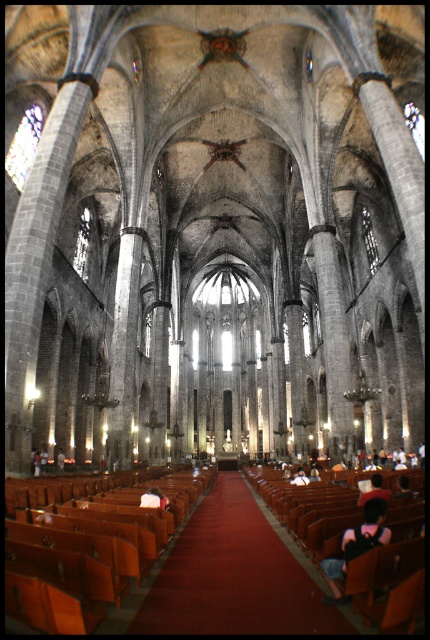
Based on the photo, you are standing at the entrance of the cathedral and want to sit down. The wooden polished chair at center is the only seating available. Based on its position, can you estimate how far it is from the entrance?

The wooden polished chair at center is located at point 0.900 on the x axis and 0.891 on the y axis, which means it is positioned near the back of the cathedral, close to the altar. Therefore, it is approximately 90 meters away from the entrance.

You are standing at the entrance of the cathedral and want to sit down. You see the wooden polished bench at center and the transparent glass window at upper center. Which object is closer to you?

The wooden polished bench at center is closer to you because it is in front of the transparent glass window at upper center, which is further away.

You are an architect visiting the cathedral and want to ensure that the wooden polished bench at center is protected from direct sunlight. Since the transparent glass window at upper right is the only window above it, can you confirm if the bench is directly under the window?

The wooden polished bench at center is positioned under the transparent glass window at upper right, so yes, the bench is directly under the window and may be exposed to direct sunlight unless there is some form of shading.